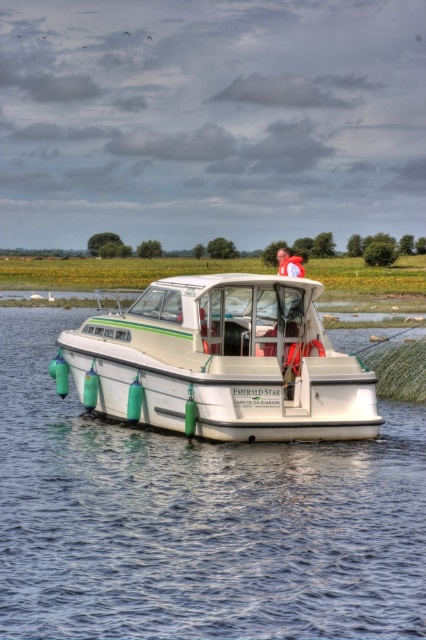
Question: Which point is farther to the camera?

Choices:
 (A) white glossy boat at center
 (B) white glossy water at center

Answer: (A)

Question: From the image, what is the correct spatial relationship of white glossy boat at center in relation to light blue fabric shirt at center?

Choices:
 (A) above
 (B) below

Answer: (B)

Question: Among these points, which one is nearest to the camera?

Choices:
 (A) (285, 259)
 (B) (152, 340)

Answer: (B)

Question: Which object appears closest to the camera in this image?

Choices:
 (A) white glossy boat at center
 (B) light blue fabric shirt at center

Answer: (A)

Question: Is white glossy boat at center thinner than light blue fabric shirt at center?

Choices:
 (A) no
 (B) yes

Answer: (A)

Question: Considering the relative positions of white glossy boat at center and light blue fabric shirt at center in the image provided, where is white glossy boat at center located with respect to light blue fabric shirt at center?

Choices:
 (A) right
 (B) left

Answer: (B)